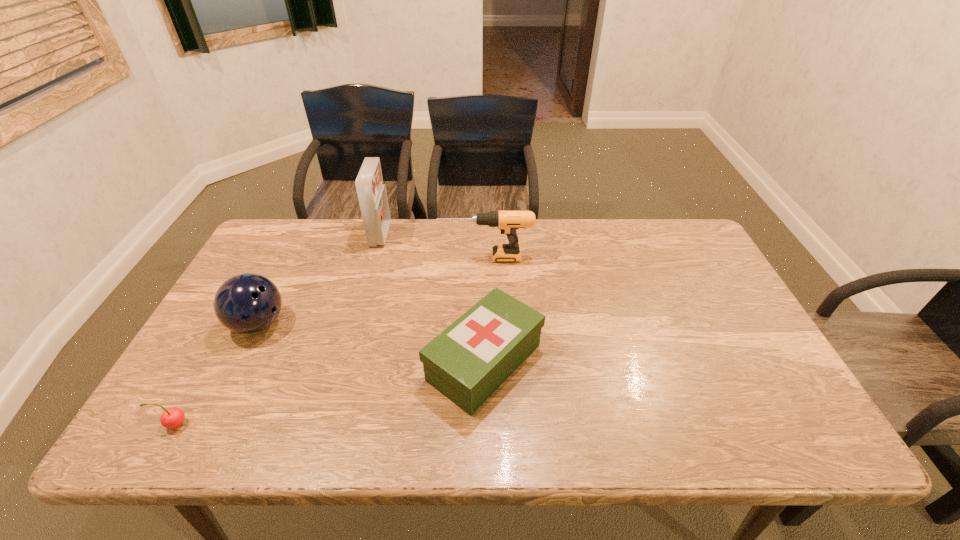
This screenshot has height=540, width=960. Identify the location of blank region between the cherry and the fourth nearest object. (330, 341).

Where is `unoccupied position between the left first-aid kit and the bowling ball`? This screenshot has width=960, height=540. unoccupied position between the left first-aid kit and the bowling ball is located at coordinates (320, 279).

Locate an element on the screen. This screenshot has height=540, width=960. free space between the fourth nearest object and the bowling ball is located at coordinates (372, 291).

Select which object is the fourth closest to the bowling ball. Please provide its 2D coordinates. Your answer should be formatted as a tuple, i.e. [(x, y)], where the tuple contains the x and y coordinates of a point satisfying the conditions above.

[(508, 222)]

Identify which object is the second closest to the tallest object. Please provide its 2D coordinates. Your answer should be formatted as a tuple, i.e. [(x, y)], where the tuple contains the x and y coordinates of a point satisfying the conditions above.

[(247, 303)]

Find the location of a particular element. Image resolution: width=960 pixels, height=540 pixels. vacant space that satisfies the following two spatial constraints: 1. on the surface of the bowling ball near the finger holes; 2. on the front side of the shortest object is located at coordinates (208, 424).

You are a GUI agent. You are given a task and a screenshot of the screen. Output one action in this format:
    pyautogui.click(x=<x>, y=<y>)
    Task: Click on the vacant space that satisfies the following two spatial constraints: 1. on the surface of the bowling ball near the finger holes; 2. on the left side of the shorter first-aid kit
    
    Given the screenshot: What is the action you would take?
    pyautogui.click(x=239, y=362)

Find the location of a particular element. free space that satisfies the following two spatial constraints: 1. on the front-facing side of the fourth tallest object; 2. on the right side of the taller first-aid kit is located at coordinates (345, 362).

I want to click on free region that satisfies the following two spatial constraints: 1. on the front-facing side of the farther first-aid kit; 2. on the front side of the cherry, so click(327, 424).

Identify the location of vacant point that satisfies the following two spatial constraints: 1. on the back side of the cherry; 2. on the left side of the fourth tallest object. (209, 362).